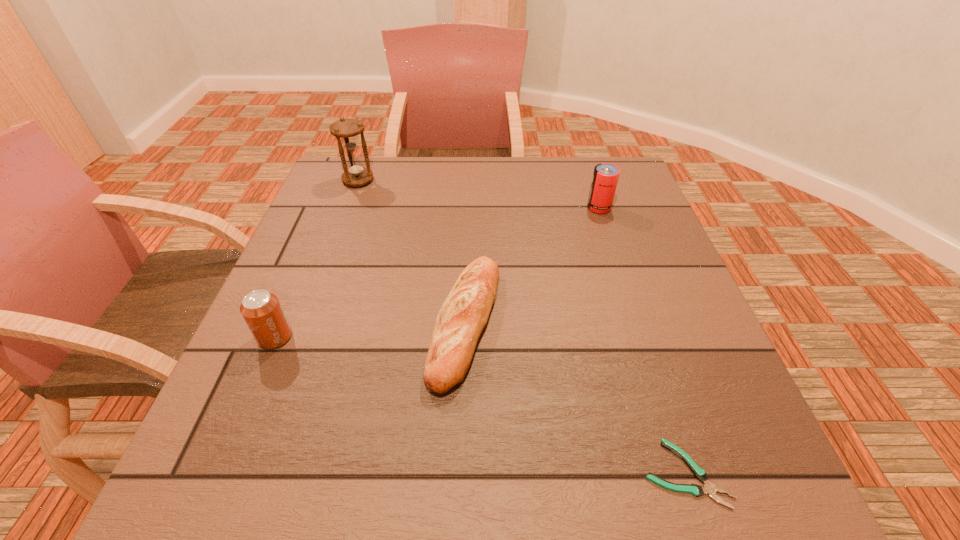
Locate an element on the screen. vacant area that lies between the tallest object and the nearest object is located at coordinates [521, 327].

At what (x,y) coordinates should I click in order to perform the action: click on empty space that is in between the shortest object and the second shortest object. Please return your answer as a coordinate pair (x, y). This screenshot has height=540, width=960. Looking at the image, I should click on (575, 398).

Locate an element on the screen. free space between the right can and the third object from right to left is located at coordinates (533, 265).

Locate an element on the screen. The image size is (960, 540). vacant area that lies between the farthest object and the nearest object is located at coordinates (521, 327).

The image size is (960, 540). I want to click on free point between the second farthest object and the nearest object, so click(642, 340).

Identify the location of free spot between the third object from left to right and the nearer can. The image size is (960, 540). (371, 330).

Find the location of `free area in between the hourglass and the third object from right to left`. free area in between the hourglass and the third object from right to left is located at coordinates (412, 252).

Locate an element on the screen. This screenshot has width=960, height=540. unoccupied position between the hourglass and the pliers is located at coordinates (x=521, y=327).

The width and height of the screenshot is (960, 540). In order to click on vacant space in between the fourth nearest object and the nearer can in this screenshot , I will do `click(437, 273)`.

Locate an element on the screen. The height and width of the screenshot is (540, 960). free area in between the shortest object and the hourglass is located at coordinates (521, 327).